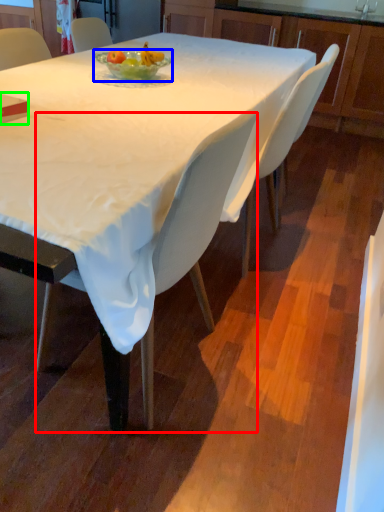
Question: Estimate the real-world distances between objects in this image. Which object is closer to chair (highlighted by a red box), bowl (highlighted by a blue box) or book (highlighted by a green box)?

Choices:
 (A) bowl
 (B) book

Answer: (B)